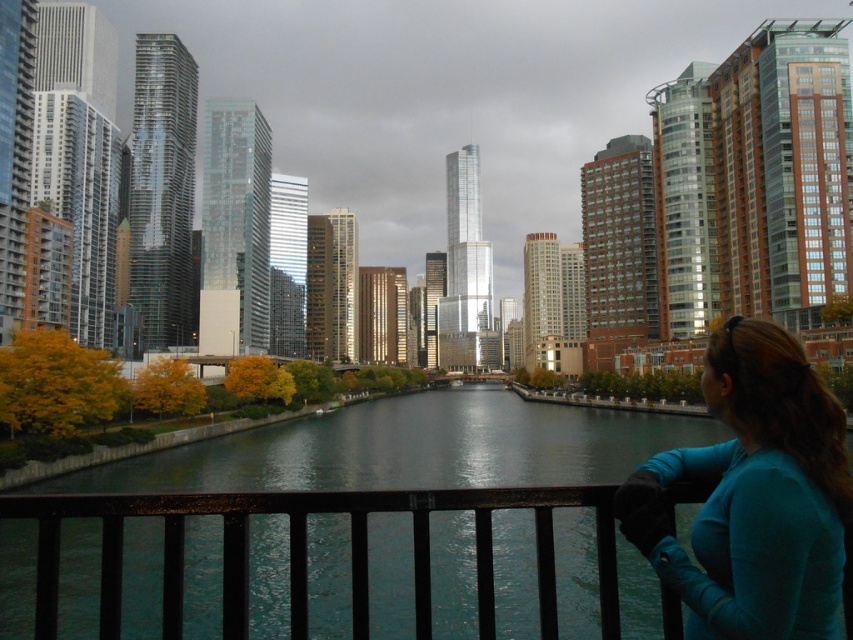
Question: From the image, what is the correct spatial relationship of teal fabric shirt at lower right in relation to metallic black railing at lower center?

Choices:
 (A) right
 (B) left

Answer: (A)

Question: Which of the following is the farthest from the observer?

Choices:
 (A) teal fabric shirt at lower right
 (B) metallic black railing at lower center

Answer: (B)

Question: Among these points, which one is farthest from the camera?

Choices:
 (A) (830, 532)
 (B) (225, 547)

Answer: (B)

Question: Which of the following is the farthest from the observer?

Choices:
 (A) (801, 436)
 (B) (296, 513)

Answer: (B)

Question: Is teal fabric shirt at lower right smaller than metallic black railing at lower center?

Choices:
 (A) no
 (B) yes

Answer: (B)

Question: Can you confirm if teal fabric shirt at lower right is positioned to the left of metallic black railing at lower center?

Choices:
 (A) yes
 (B) no

Answer: (B)